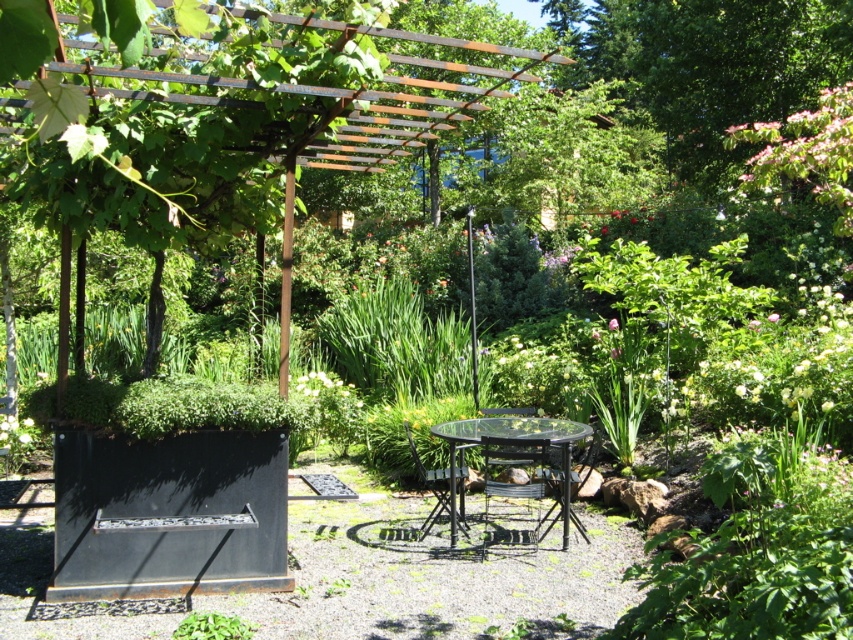
Question: Which point is closer to the camera?

Choices:
 (A) metallic black chair at center
 (B) black metal chair at center

Answer: (A)

Question: In this image, where is transparent glass table at center located relative to black metal chair at center?

Choices:
 (A) below
 (B) above

Answer: (B)

Question: Is transparent glass table at center above metallic black chair at center?

Choices:
 (A) no
 (B) yes

Answer: (A)

Question: Among these objects, which one is farthest from the camera?

Choices:
 (A) transparent glass table at center
 (B) metallic black chair at center

Answer: (A)

Question: Which object is farther from the camera taking this photo?

Choices:
 (A) black metal chair at center
 (B) transparent glass table at center

Answer: (A)

Question: Is metallic black chair at center in front of black metal chair at center?

Choices:
 (A) no
 (B) yes

Answer: (B)